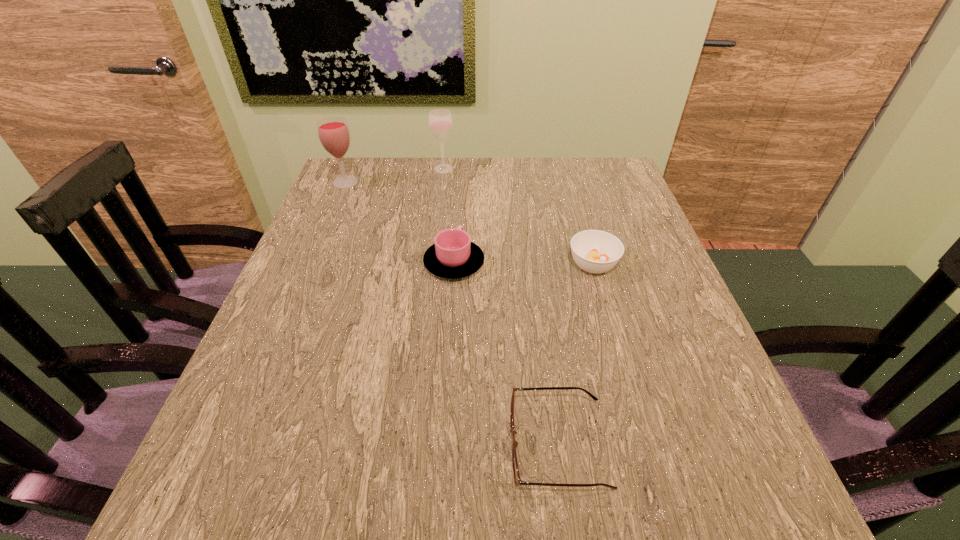
Image resolution: width=960 pixels, height=540 pixels. Identify the location of the leftmost object. (333, 132).

Identify the location of the nearer wineglass. The width and height of the screenshot is (960, 540). (333, 132).

This screenshot has width=960, height=540. I want to click on the farthest object, so click(440, 121).

Locate an element on the screen. This screenshot has height=540, width=960. the farther wineglass is located at coordinates (440, 121).

Image resolution: width=960 pixels, height=540 pixels. Find the location of `the third tallest object`. the third tallest object is located at coordinates (453, 256).

Locate an element on the screen. the rightmost object is located at coordinates (594, 251).

Locate an element on the screen. The width and height of the screenshot is (960, 540). the fourth tallest object is located at coordinates (594, 251).

Find the location of `the shortest object`. the shortest object is located at coordinates (517, 479).

Locate an element on the screen. The height and width of the screenshot is (540, 960). the nearest object is located at coordinates (517, 479).

I want to click on vacant space situated on the back of the nearer wineglass, so click(352, 166).